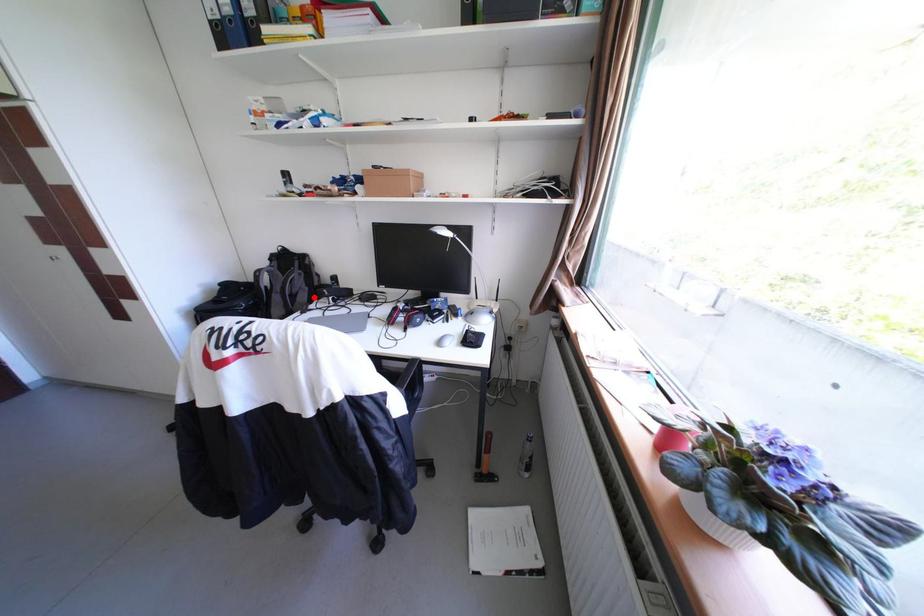
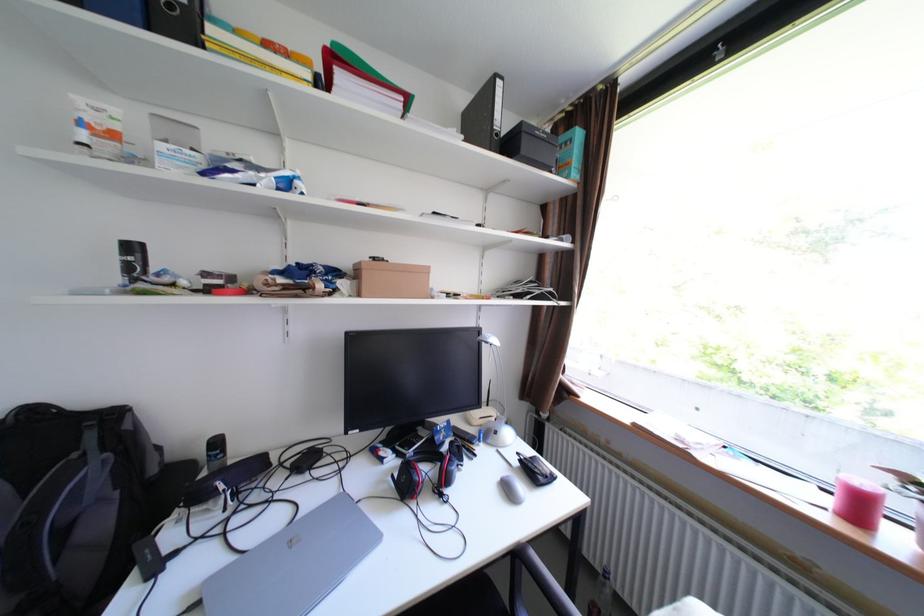
The point at the highlighted location is marked in the first image. Where is the corresponding point in the second image?

(110, 524)